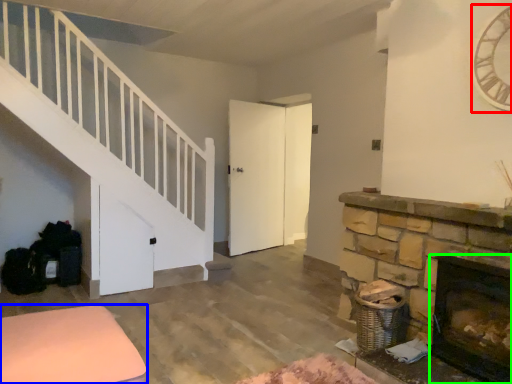
Question: Considering the real-world distances, which object is closest to clock (highlighted by a red box)? furniture (highlighted by a blue box) or fireplace (highlighted by a green box).

Choices:
 (A) furniture
 (B) fireplace

Answer: (B)